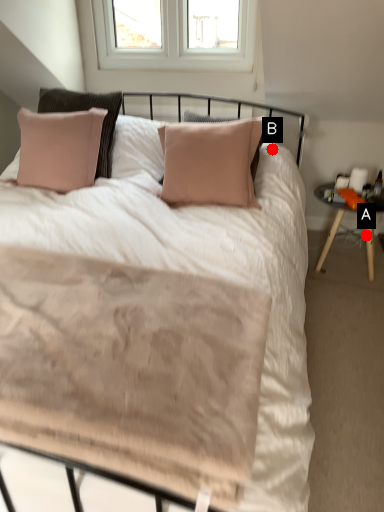
Question: Two points are circled on the image, labeled by A and B beside each circle. Which point is further to the camera?

Choices:
 (A) A is further
 (B) B is further

Answer: (A)